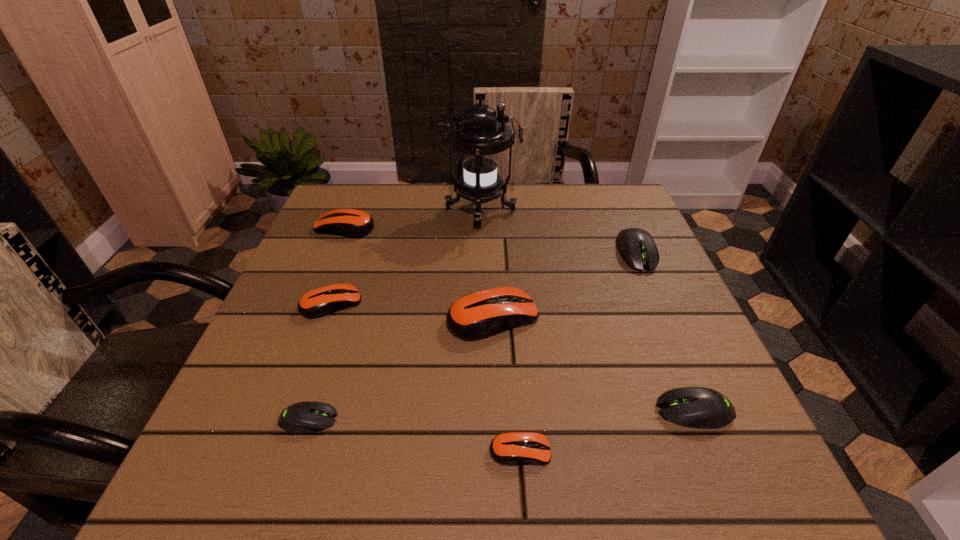
At what (x,y) coordinates should I click in order to perform the action: click on lantern located at the far edge. Please return your answer as a coordinate pair (x, y). This screenshot has width=960, height=540. Looking at the image, I should click on (480, 134).

You are a GUI agent. You are given a task and a screenshot of the screen. Output one action in this format:
    pyautogui.click(x=<x>, y=<y>)
    Task: Click on the object that is at the near edge
    The width and height of the screenshot is (960, 540).
    Given the screenshot: What is the action you would take?
    pyautogui.click(x=512, y=448)

Locate an element on the screen. object at the far left corner is located at coordinates (353, 223).

The height and width of the screenshot is (540, 960). I want to click on object located at the far right corner, so [x=637, y=248].

Locate an element on the screen. The width and height of the screenshot is (960, 540). vacant area at the far edge of the desktop is located at coordinates (492, 200).

Where is `vacant area at the near edge of the desktop`? vacant area at the near edge of the desktop is located at coordinates (500, 471).

The height and width of the screenshot is (540, 960). Identify the location of vacant point at the left edge. (249, 437).

Locate an element on the screen. This screenshot has height=540, width=960. vacant space at the right edge is located at coordinates (677, 367).

I want to click on free space at the far left corner of the desktop, so click(377, 196).

This screenshot has width=960, height=540. In the image, there is a desktop. Find the location of `blank space at the far right corner`. blank space at the far right corner is located at coordinates (619, 204).